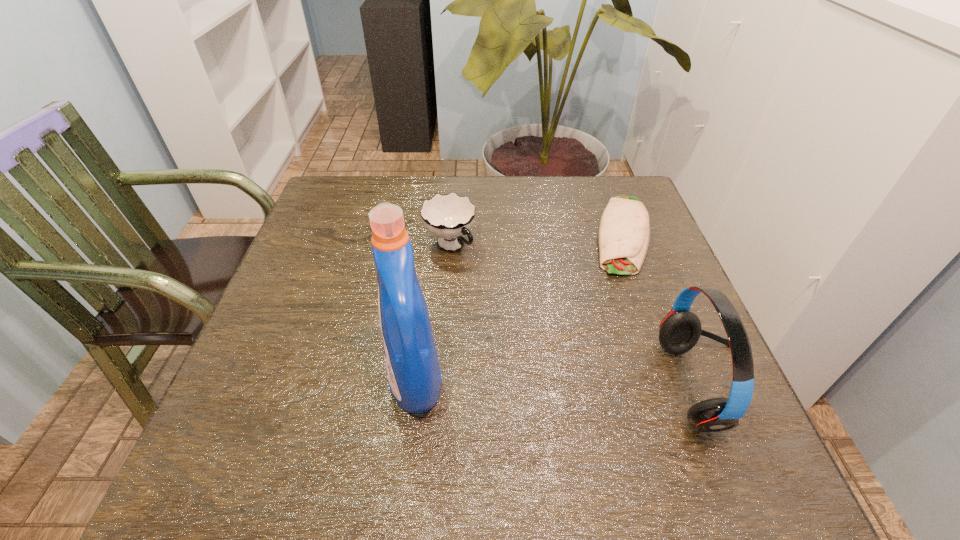
Locate an element on the screen. vacant space that satisfies the following two spatial constraints: 1. on the front side of the cup; 2. with the microphone attached to the side of the third shortest object is located at coordinates pos(439,386).

Identify the location of free location that satisfies the following two spatial constraints: 1. on the front side of the burrito; 2. with the microphone attached to the side of the headset. (680, 386).